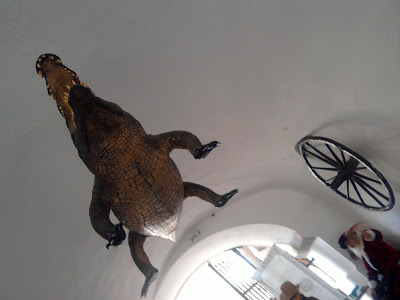
Locate an element on the screen. arched entranceway is located at coordinates (258, 229), (181, 257).